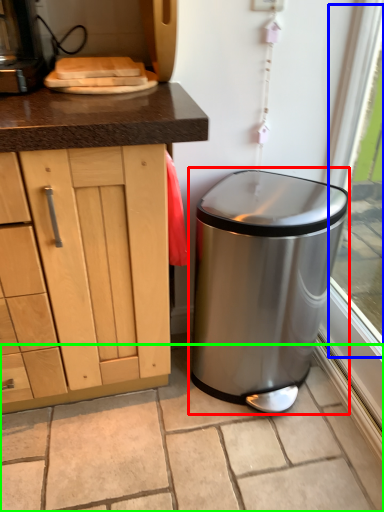
Question: Which is farther away from waste container (highlighted by a red box)? window screen (highlighted by a blue box) or granite (highlighted by a green box)?

Choices:
 (A) window screen
 (B) granite

Answer: (A)